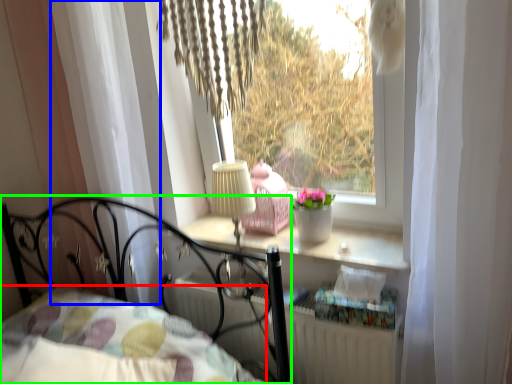
Question: Which is nearer to the bedding (highlighted by a red box)? curtain (highlighted by a blue box) or bed (highlighted by a green box).

Choices:
 (A) curtain
 (B) bed

Answer: (B)